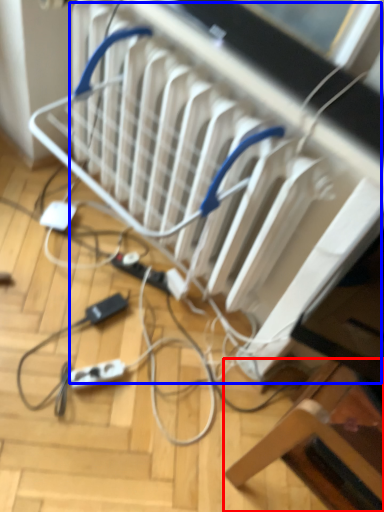
Question: Which object appears farthest to the camera in this image, furniture (highlighted by a red box) or radiator (highlighted by a blue box)?

Choices:
 (A) furniture
 (B) radiator

Answer: (B)